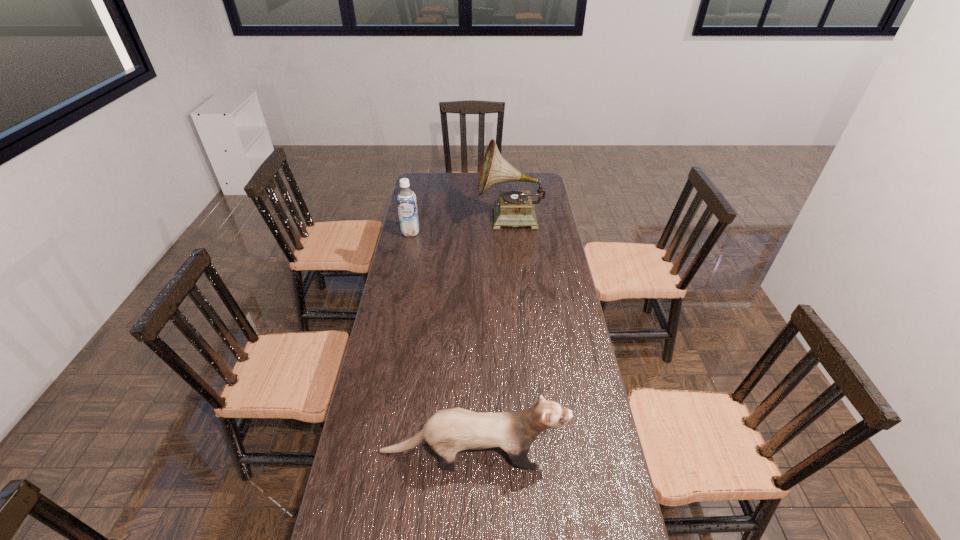
Image resolution: width=960 pixels, height=540 pixels. I want to click on ferret that is at the left edge, so click(x=449, y=431).

Identify the location of record player that is positioned at the right edge. The image size is (960, 540). (514, 208).

At what (x,y) coordinates should I click in order to perform the action: click on ferret that is at the right edge. Please return your answer as a coordinate pair (x, y). Looking at the image, I should click on (449, 431).

Locate an element on the screen. Image resolution: width=960 pixels, height=540 pixels. free space at the far edge is located at coordinates click(492, 191).

I want to click on free space at the left edge, so pyautogui.click(x=417, y=350).

You are a GUI agent. You are given a task and a screenshot of the screen. Output one action in this format:
    pyautogui.click(x=<x>, y=<y>)
    Task: Click on the vacant space at the right edge of the desktop
    
    Given the screenshot: What is the action you would take?
    pyautogui.click(x=565, y=384)

At what (x,y) coordinates should I click in order to perform the action: click on empty space that is in between the soya milk and the tallest object. Please return your answer as a coordinate pair (x, y). This screenshot has width=960, height=540. Looking at the image, I should click on (460, 226).

This screenshot has height=540, width=960. In order to click on vacant area that lies between the tallest object and the shortest object in this screenshot , I will do `click(492, 335)`.

Locate an element on the screen. empty space that is in between the soya milk and the nearest object is located at coordinates (442, 342).

Image resolution: width=960 pixels, height=540 pixels. Find the location of `object that is the closest to the record player`. object that is the closest to the record player is located at coordinates (406, 200).